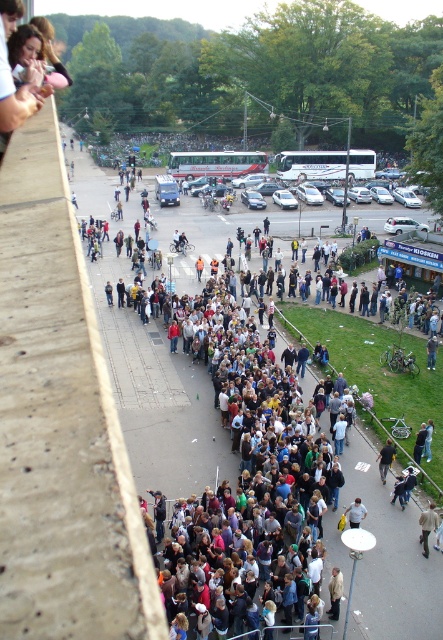
Is dark gray concrete sidewalk at lower center further to camera compared to light blue shirt at center?

No, dark gray concrete sidewalk at lower center is closer to the viewer.

Can you confirm if dark gray concrete sidewalk at lower center is wider than light blue shirt at center?

Yes, dark gray concrete sidewalk at lower center is wider than light blue shirt at center.

Is point (362, 560) positioned in front of point (357, 497)?

That is True.

At what (x,y) coordinates should I click in order to perform the action: click on dark gray concrete sidewalk at lower center. Please return your answer as a coordinate pair (x, y). Looking at the image, I should click on (159, 400).

Between dark blue jeans at lower center and light blue shirt at center, which one has more height?

Standing taller between the two is dark blue jeans at lower center.

Is dark blue jeans at lower center shorter than light blue shirt at center?

No.

Which is behind, point (387, 451) or point (350, 515)?

The point (387, 451) is more distant.

Image resolution: width=443 pixels, height=640 pixels. Find the location of `dark blue jeans at lower center`. dark blue jeans at lower center is located at coordinates (385, 458).

Does dark gray concrete sidewalk at lower center come in front of dark blue jeans at lower center?

Yes, dark gray concrete sidewalk at lower center is closer to the viewer.

Who is positioned more to the left, dark gray concrete sidewalk at lower center or dark blue jeans at lower center?

Positioned to the left is dark gray concrete sidewalk at lower center.

Who is more distant from viewer, (x=365, y=461) or (x=380, y=458)?

The point (x=365, y=461) is more distant.

At what (x,y) coordinates should I click in order to perform the action: click on dark gray concrete sidewalk at lower center. Please return your answer as a coordinate pair (x, y). Looking at the image, I should click on (159, 400).